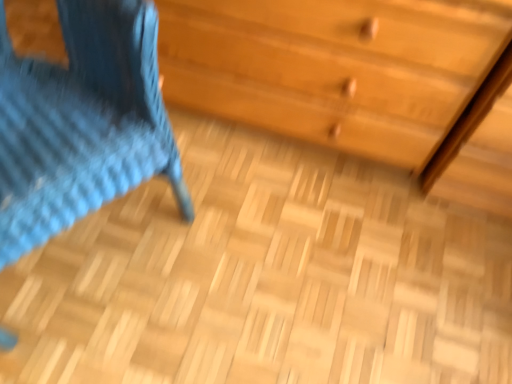
Question: Considering the positions of point (10, 119) and point (386, 99), is point (10, 119) closer or farther from the camera than point (386, 99)?

Choices:
 (A) closer
 (B) farther

Answer: (A)

Question: Choose the correct answer: Is blue knitted chair at left inside wooden chest of drawers at upper right or outside it?

Choices:
 (A) outside
 (B) inside

Answer: (A)

Question: In terms of width, does blue knitted chair at left look wider or thinner when compared to wooden chest of drawers at upper right?

Choices:
 (A) thin
 (B) wide

Answer: (B)

Question: From a real-world perspective, is wooden chest of drawers at upper right above or below blue knitted chair at left?

Choices:
 (A) above
 (B) below

Answer: (B)

Question: In terms of width, does wooden chest of drawers at upper right look wider or thinner when compared to blue knitted chair at left?

Choices:
 (A) wide
 (B) thin

Answer: (B)

Question: In terms of size, does wooden chest of drawers at upper right appear bigger or smaller than blue knitted chair at left?

Choices:
 (A) big
 (B) small

Answer: (A)

Question: From the image's perspective, is wooden chest of drawers at upper right above or below blue knitted chair at left?

Choices:
 (A) above
 (B) below

Answer: (A)